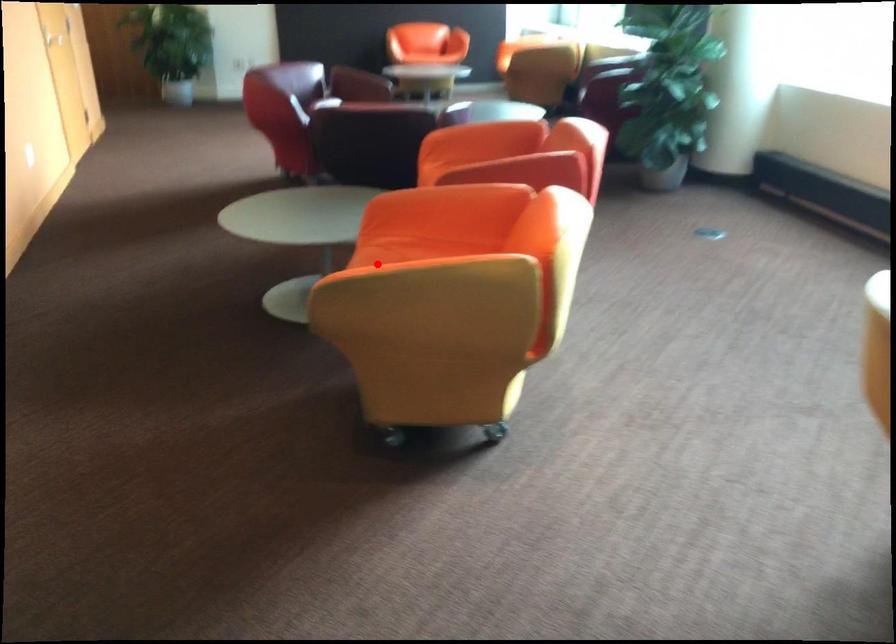
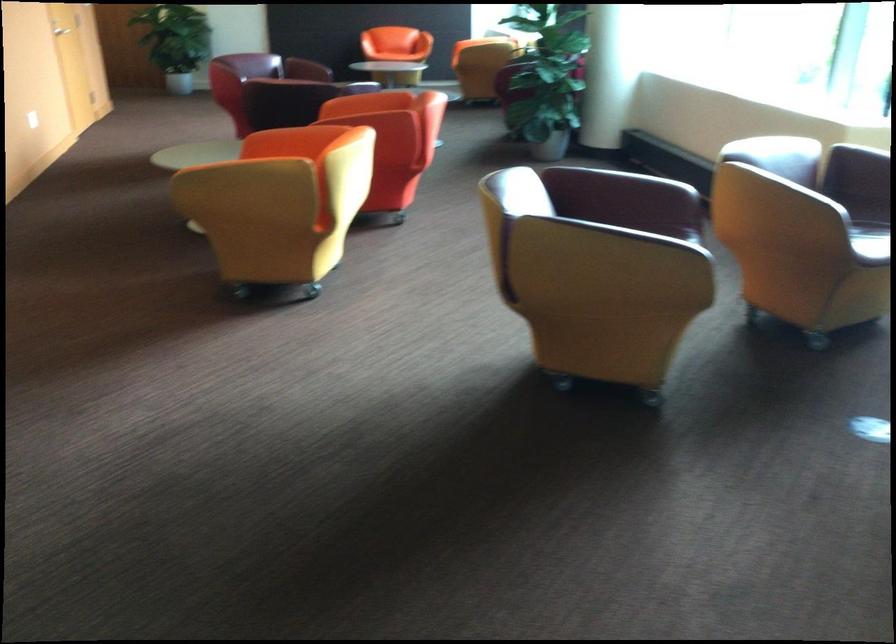
Question: I am providing you with two images of the same scene from different viewpoints. A red point is shown in image1. For the corresponding object point in image2, is it positioned nearer or farther from the camera?

Choices:
 (A) Nearer
 (B) Farther

Answer: (B)